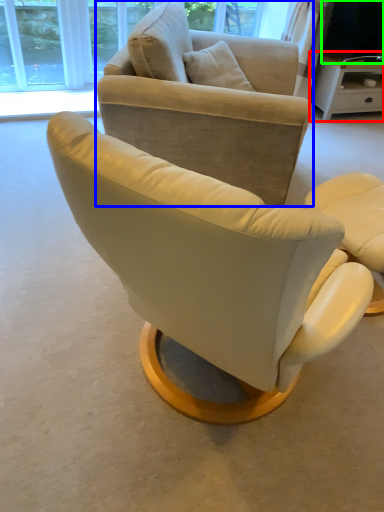
Question: Based on their relative distances, which object is nearer to desk (highlighted by a red box)? Choose from chair (highlighted by a blue box) and television (highlighted by a green box).

Choices:
 (A) chair
 (B) television

Answer: (B)